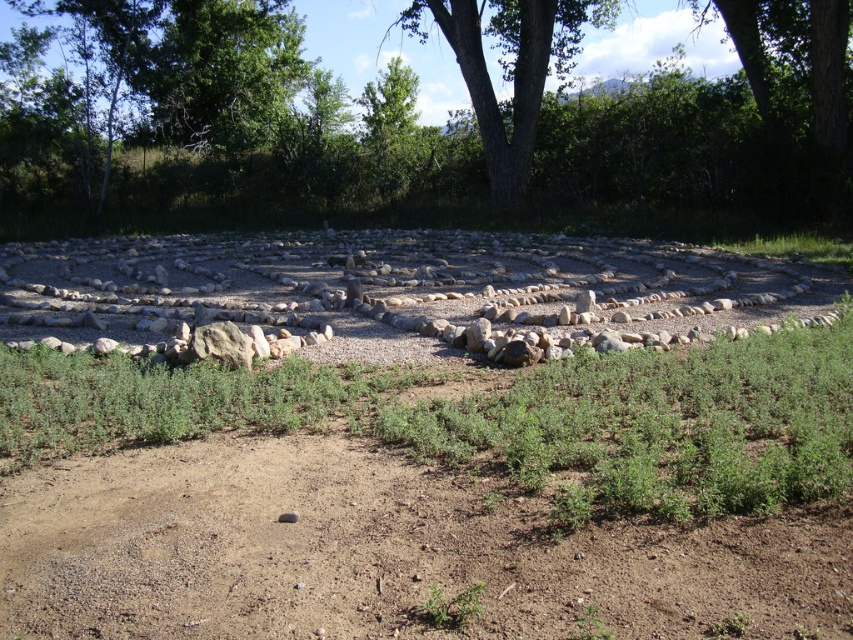
You are planning to plant a new tree in the garden. You have two options based on the image. Which tree would you choose if you want a wider canopy? Please refer to the green leafy tree at center and the green rough bark tree at upper center in the image.

The green leafy tree at center has a larger width than the green rough bark tree at upper center, so you should choose the green leafy tree at center for a wider canopy.

You are standing at the entrance of the labyrinth and want to reach the green leafy tree at center. Which direction should you walk to get there?

The green leafy tree at center is located at point (418, 120), so you should walk towards the center of the labyrinth to reach it.